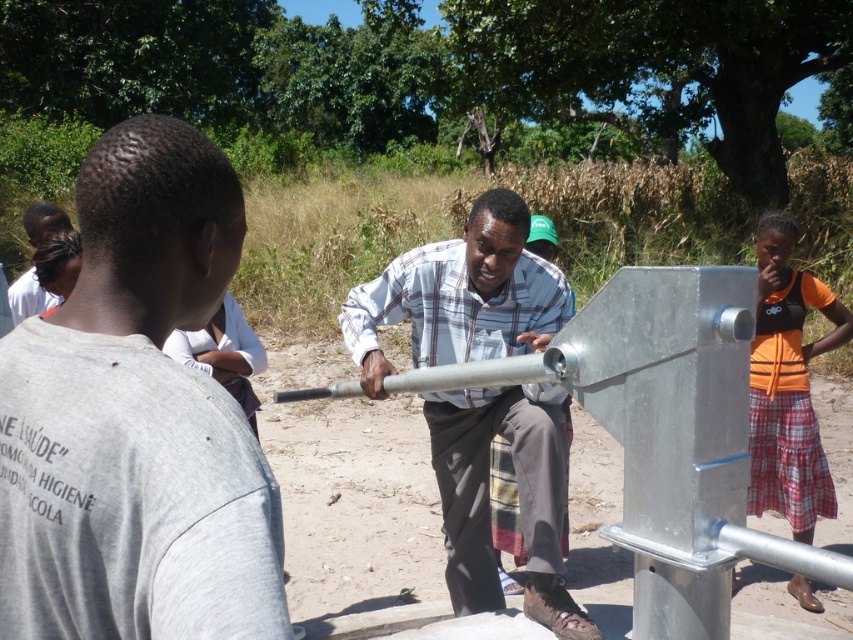
You are a photographer trying to capture a clear shot of the metallic silver pipe at center and the dark brown hair at upper left. Can you see both objects without any obstruction?

Yes, the metallic silver pipe at center is in front of dark brown hair at upper left, so the photographer can see both objects without any obstruction as they are positioned in a way that allows visibility of both.

You are a visitor at this rural location and want to locate the metallic silver water pump at center. Where should you look relative to the dark brown hair at upper left?

The metallic silver water pump at center is positioned on the right side of dark brown hair at upper left, so you should look to the right of the dark brown hair at upper left to find it.